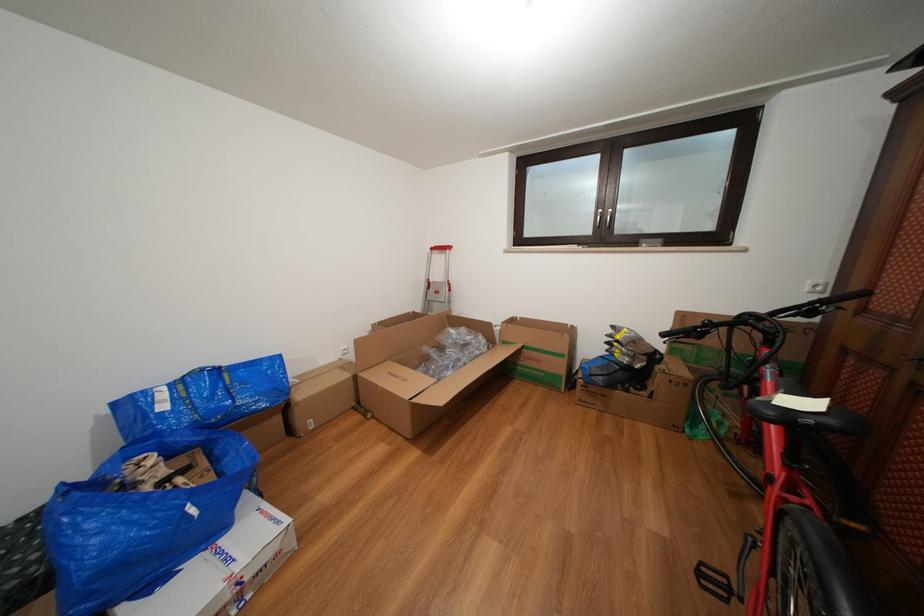
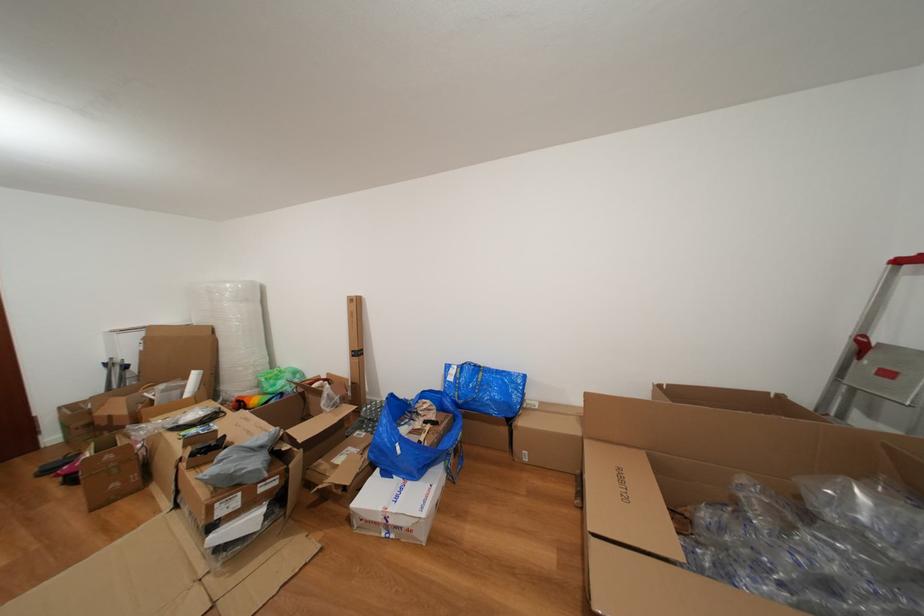
In the second image, find the point that corresponds to (x=459, y=359) in the first image.

(839, 559)